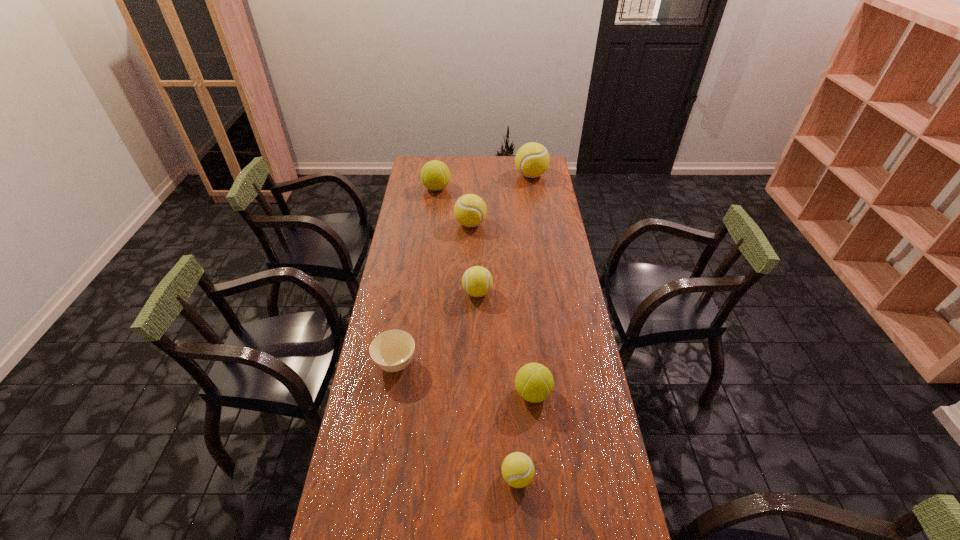
Where is `object that is at the far edge`? Image resolution: width=960 pixels, height=540 pixels. object that is at the far edge is located at coordinates (x=532, y=159).

What are the coordinates of `tennis ball at the left edge` in the screenshot? It's located at (435, 175).

Identify the location of sugar bowl situated at the left edge. The width and height of the screenshot is (960, 540). (392, 351).

The width and height of the screenshot is (960, 540). I want to click on object at the far right corner, so click(532, 159).

In the image, there is a desktop. Where is `vacant space at the left edge`? This screenshot has height=540, width=960. vacant space at the left edge is located at coordinates (396, 475).

The width and height of the screenshot is (960, 540). I want to click on free space at the right edge of the desktop, so click(531, 201).

You are a GUI agent. You are given a task and a screenshot of the screen. Output one action in this format:
    pyautogui.click(x=<x>, y=<y>)
    Task: Click on the vacant area between the farther green tennis ball and the sugar bowl
    This screenshot has width=960, height=540.
    Given the screenshot: What is the action you would take?
    pyautogui.click(x=416, y=276)

I want to click on free space between the sugar bowl and the rightmost yellow tennis ball, so click(464, 269).

The image size is (960, 540). In order to click on free spot between the fourth farthest object and the left green tennis ball in this screenshot , I will do `click(457, 240)`.

This screenshot has height=540, width=960. Identify the location of free space that is in between the tallest object and the left green tennis ball. (484, 182).